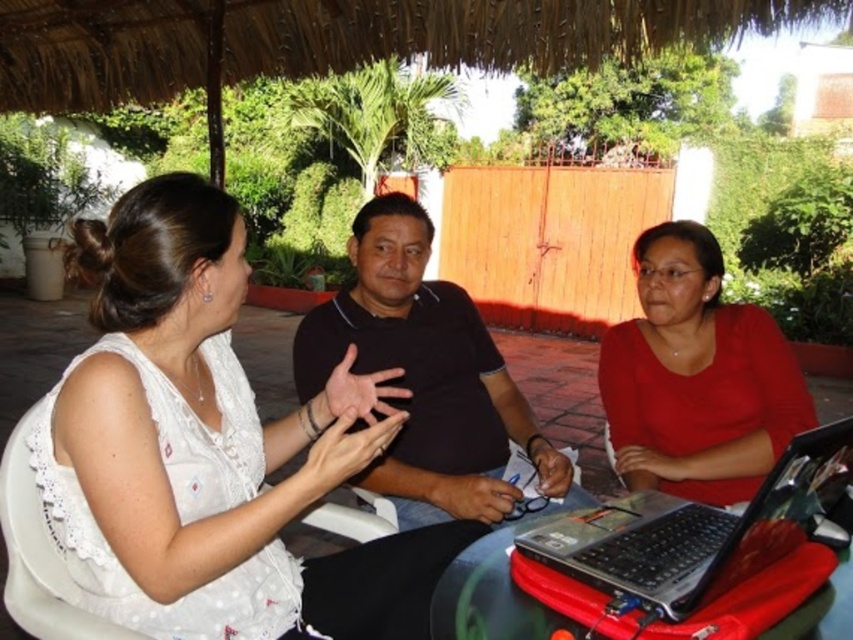
Question: Can you confirm if white lace blouse at upper left is positioned below silver/black plastic laptop at lower right?

Choices:
 (A) no
 (B) yes

Answer: (A)

Question: Can you confirm if silver/black plastic laptop at lower right is positioned to the left of white fabric chair at center?

Choices:
 (A) no
 (B) yes

Answer: (A)

Question: Which point is farther from the camera taking this photo?

Choices:
 (A) (270, 620)
 (B) (460, 381)

Answer: (B)

Question: Is matte red shirt at center above white fabric chair at center?

Choices:
 (A) yes
 (B) no

Answer: (A)

Question: Which of these objects is positioned closest to the white fabric chair at center?

Choices:
 (A) silver/black plastic laptop at lower right
 (B) black matte shirt at center
 (C) white lace blouse at upper left

Answer: (C)

Question: Which object is farther from the camera taking this photo?

Choices:
 (A) silver/black plastic laptop at lower right
 (B) black matte shirt at center
 (C) matte red shirt at center

Answer: (C)